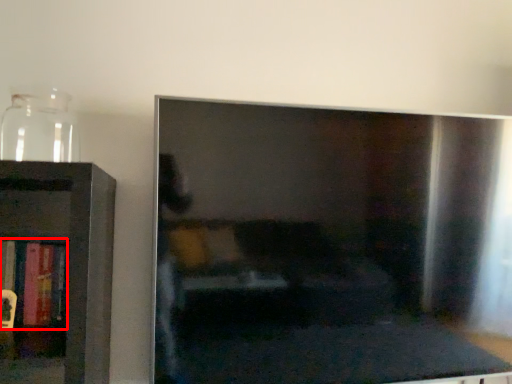
Question: From the image's perspective, where is book (annotated by the red box) located in relation to glass vase in the image?

Choices:
 (A) above
 (B) below

Answer: (B)